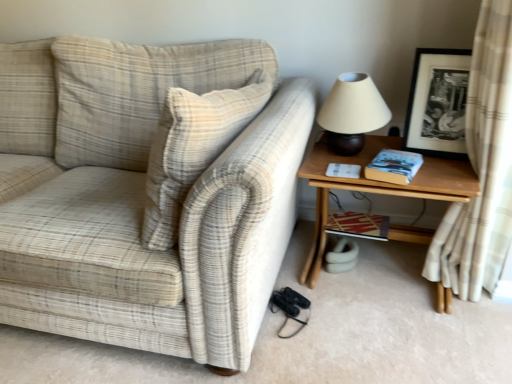
What do you see at coordinates (145, 191) in the screenshot? Image resolution: width=512 pixels, height=384 pixels. I see `beige plaid fabric couch at left` at bounding box center [145, 191].

Find the location of a particular element. The image size is (512, 384). beige plaid fabric couch at left is located at coordinates (145, 191).

Where is `beige fabric curtain at right`? The image size is (512, 384). beige fabric curtain at right is located at coordinates (482, 168).

This screenshot has height=384, width=512. What are the coordinates of `beige plaid fabric couch at left` in the screenshot? It's located at [x=145, y=191].

Is beige fabric curtain at right outside of beige plaid pillow at upper left?

Yes, beige fabric curtain at right is outside of beige plaid pillow at upper left.

Considering the positions of points (511, 214) and (179, 198), is point (511, 214) closer to camera compared to point (179, 198)?

No, it is not.

From the picture: Is beige fabric curtain at right far away from beige plaid pillow at upper left?

They are positioned close to each other.

In the scene shown: What's the angular difference between beige fabric curtain at right and beige plaid pillow at upper left's facing directions?

9.03 degrees separate the facing orientations of beige fabric curtain at right and beige plaid pillow at upper left.

Which object is positioned more to the left, wooden table at right or hardcover book at right, the first book viewed from the front?

From the viewer's perspective, hardcover book at right, the first book viewed from the front, appears more on the left side.

How many degrees apart are the facing directions of wooden table at right and hardcover book at right, marked as the 1th book in a top-to-bottom arrangement?

The facing directions of wooden table at right and hardcover book at right, marked as the 1th book in a top-to-bottom arrangement, are 12.9 degrees apart.

From the picture: From a real-world perspective, is wooden table at right on hardcover book at right, which ranks as the 2th book in bottom-to-top order?

Actually, wooden table at right is physically below hardcover book at right, which ranks as the 2th book in bottom-to-top order, in the real world.

Do you think beige fabric curtain at right is within wooden table at right, or outside of it?

Result: beige fabric curtain at right is spatially situated outside wooden table at right.

Image resolution: width=512 pixels, height=384 pixels. Identify the location of curtain in front of the wooden table at right. (482, 168).

Relative to wooden table at right, is beige fabric curtain at right in front or behind?

Clearly, beige fabric curtain at right is in front of wooden table at right.

Does beige fabric curtain at right have a lesser width compared to wooden table at right?

Yes, beige fabric curtain at right is thinner than wooden table at right.

Is beige plaid pillow at upper left thinner than beige plaid fabric couch at left?

Correct, the width of beige plaid pillow at upper left is less than that of beige plaid fabric couch at left.

Is beige plaid pillow at upper left oriented away from beige plaid fabric couch at left?

Yes, beige plaid pillow at upper left is positioned with its back facing beige plaid fabric couch at left.

In the scene shown: Does beige plaid pillow at upper left lie in front of beige plaid fabric couch at left?

That is False.

Is beige plaid pillow at upper left bigger than beige plaid fabric couch at left?

Actually, beige plaid pillow at upper left might be smaller than beige plaid fabric couch at left.

Would you say hardcover book at right, which is the 2th book in back-to-front order, is outside matte beige lampshade at upper right?

hardcover book at right, which is the 2th book in back-to-front order, is positioned outside matte beige lampshade at upper right.

Image resolution: width=512 pixels, height=384 pixels. Find the location of `book that is in front of the matte beige lampshade at upper right`. book that is in front of the matte beige lampshade at upper right is located at coordinates (394, 166).

Is hardcover book at right, which ranks as the 2th book in bottom-to-top order, positioned far away from matte beige lampshade at upper right?

hardcover book at right, which ranks as the 2th book in bottom-to-top order, is near matte beige lampshade at upper right, not far away.

Could you measure the distance between hardcover book at right, the first book viewed from the front, and matte beige lampshade at upper right?

They are 6.75 inches apart.

Would you say wooden table at right is inside or outside black matte picture frame at upper right?

wooden table at right is not enclosed by black matte picture frame at upper right.

From the image's perspective, is wooden table at right positioned above or below black matte picture frame at upper right?

wooden table at right is situated lower than black matte picture frame at upper right in the image.

What's the angular difference between wooden table at right and black matte picture frame at upper right's facing directions?

They differ by 6.72 degrees in their facing directions.

Considering the relative positions of matte beige lampshade at upper right and beige fabric curtain at right in the image provided, is matte beige lampshade at upper right to the left of beige fabric curtain at right from the viewer's perspective?

Correct, you'll find matte beige lampshade at upper right to the left of beige fabric curtain at right.

Based on the photo, from a real-world perspective, which is physically above, matte beige lampshade at upper right or beige fabric curtain at right?

matte beige lampshade at upper right is physically above.

Can we say matte beige lampshade at upper right lies outside beige fabric curtain at right?

matte beige lampshade at upper right lies outside beige fabric curtain at right's area.

How much distance is there between matte beige lampshade at upper right and beige fabric curtain at right?

matte beige lampshade at upper right is 40.44 centimeters away from beige fabric curtain at right.

You are a GUI agent. You are given a task and a screenshot of the screen. Output one action in this format:
    pyautogui.click(x=<x>, y=<y>)
    Task: Click on the throw pillow that is above the beige fabric curtain at right (from the image's perspective)
    
    Given the screenshot: What is the action you would take?
    pyautogui.click(x=193, y=148)

At what (x,y) coordinates should I click in order to perform the action: click on the 1st book behind the wooden table at right. Please return your answer as a coordinate pair (x, y). Looking at the image, I should click on (394, 166).

From the image, which object appears to be nearer to hardcover book at right, marked as the 1th book in a top-to-bottom arrangement, beige plaid pillow at upper left or black matte picture frame at upper right?

black matte picture frame at upper right.

Looking at this image, looking at the image, which one is located closer to beige plaid fabric couch at left, beige fabric curtain at right or striped paper book at lower right, which is counted as the first book, starting from the bottom?

striped paper book at lower right, which is counted as the first book, starting from the bottom, lies closer to beige plaid fabric couch at left than the other object.

Looking at the image, which one is located closer to beige plaid fabric couch at left, black matte picture frame at upper right or beige plaid pillow at upper left?

The object closer to beige plaid fabric couch at left is beige plaid pillow at upper left.

From the image, which object appears to be farther from beige fabric curtain at right, beige plaid pillow at upper left or wooden table at right?

Based on the image, beige plaid pillow at upper left appears to be further to beige fabric curtain at right.

Looking at this image, based on their spatial positions, is beige plaid fabric couch at left or striped paper book at lower right, which ranks as the first book in back-to-front order, closer to hardcover book at right, the first book viewed from the front?

striped paper book at lower right, which ranks as the first book in back-to-front order, is closer to hardcover book at right, the first book viewed from the front.

Based on their spatial positions, is matte beige lampshade at upper right or beige plaid pillow at upper left closer to beige fabric curtain at right?

The object closer to beige fabric curtain at right is matte beige lampshade at upper right.

Considering their positions, is beige fabric curtain at right positioned closer to matte beige lampshade at upper right than wooden table at right?

The object closer to matte beige lampshade at upper right is wooden table at right.

Looking at the image, which one is located further to black matte picture frame at upper right, beige fabric curtain at right or beige plaid pillow at upper left?

Among the two, beige plaid pillow at upper left is located further to black matte picture frame at upper right.

This screenshot has width=512, height=384. What are the coordinates of `picture frame between matte beige lampshade at upper right and beige fabric curtain at right` in the screenshot? It's located at (438, 103).

At what (x,y) coordinates should I click in order to perform the action: click on table lamp between beige plaid pillow at upper left and hardcover book at right, the first book viewed from the front, from left to right. Please return your answer as a coordinate pair (x, y). The image size is (512, 384). Looking at the image, I should click on (352, 113).

Where is `table lamp between black matte picture frame at upper right and striped paper book at lower right, the 2th book from the top, in the up-down direction`? This screenshot has width=512, height=384. table lamp between black matte picture frame at upper right and striped paper book at lower right, the 2th book from the top, in the up-down direction is located at coordinates (352, 113).

Where is `table lamp between beige plaid pillow at upper left and wooden table at right from left to right`? Image resolution: width=512 pixels, height=384 pixels. table lamp between beige plaid pillow at upper left and wooden table at right from left to right is located at coordinates (352, 113).